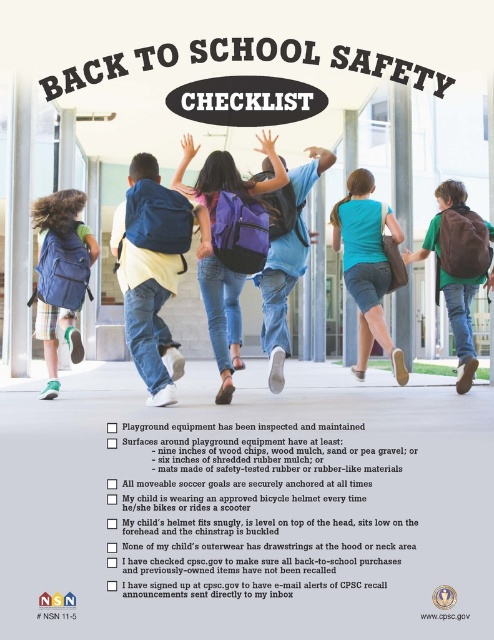
Is point (222, 289) closer to camera compared to point (281, 333)?

Yes, point (222, 289) is closer to viewer.

Looking at this image, can you confirm if matte purple backpack at center is smaller than matte blue backpack at center?

No.

This screenshot has width=494, height=640. What do you see at coordinates (214, 248) in the screenshot?
I see `matte purple backpack at center` at bounding box center [214, 248].

Image resolution: width=494 pixels, height=640 pixels. Identify the location of matte purple backpack at center. (214, 248).

Which of these two, teal fabric backpack at center or matte blue backpack at left, stands shorter?

matte blue backpack at left is shorter.

Is teal fabric backpack at center behind matte blue backpack at left?

Yes, it is.

The image size is (494, 640). I want to click on teal fabric backpack at center, so click(x=367, y=266).

Based on the photo, measure the distance between point [265,192] and camera.

Point [265,192] and camera are 6.37 meters apart.

Is matte purple backpack at center above matte blue backpack at left?

Correct, matte purple backpack at center is located above matte blue backpack at left.

Between point (174, 182) and point (73, 253), which one is positioned behind?

Positioned behind is point (73, 253).

Where is `matte purple backpack at center`? The image size is (494, 640). matte purple backpack at center is located at coordinates (214, 248).